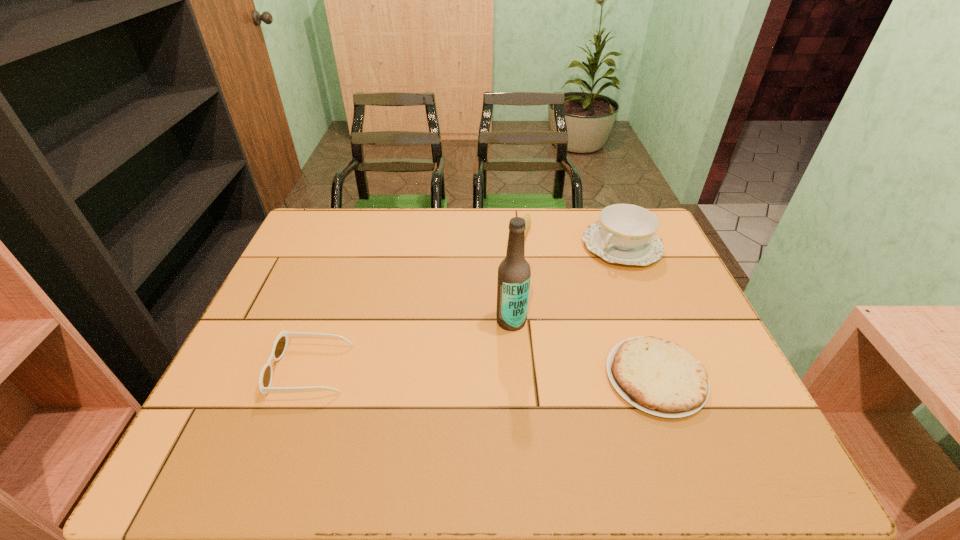
I want to click on the fourth tallest object, so click(280, 345).

Find the location of a particular element. The height and width of the screenshot is (540, 960). the leftmost object is located at coordinates (280, 345).

The image size is (960, 540). I want to click on tortilla, so click(659, 377).

The image size is (960, 540). What are the coordinates of `banana` in the screenshot? It's located at (527, 218).

The width and height of the screenshot is (960, 540). In order to click on the third nearest object in this screenshot , I will do `click(514, 273)`.

This screenshot has height=540, width=960. In order to click on the tallest object in this screenshot , I will do `click(514, 273)`.

Where is `chinaware`? This screenshot has height=540, width=960. chinaware is located at coordinates (626, 234).

Find the location of a particular element. This screenshot has height=540, width=960. vacant area situated 0.060m with the lenses of the leftmost object facing outward is located at coordinates (247, 369).

Find the location of a particular element. Image resolution: width=960 pixels, height=540 pixels. free space located on the left of the shortest object is located at coordinates (527, 377).

Identify the location of vacant area located 0.390m at the stem of the banana. pos(479,345).